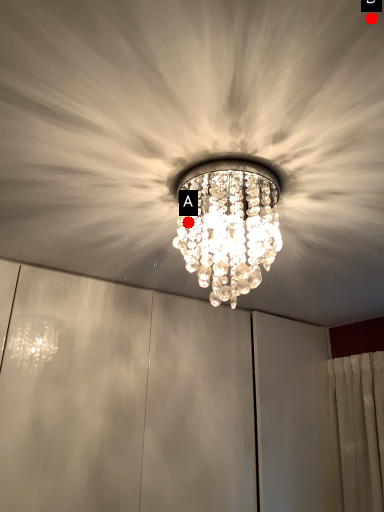
Question: Two points are circled on the image, labeled by A and B beside each circle. Which of the following is the farthest from the observer?

Choices:
 (A) A is further
 (B) B is further

Answer: (A)